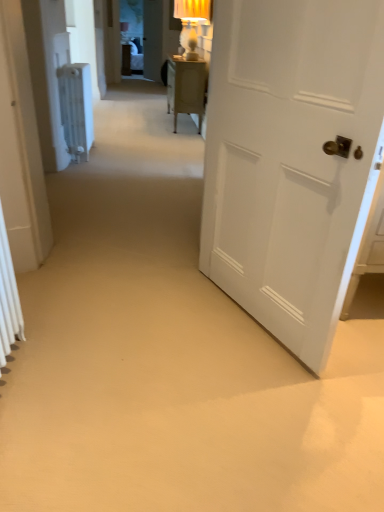
The height and width of the screenshot is (512, 384). I want to click on white matte radiator at left, acting as the first door starting from the left, so click(21, 148).

Locate an element on the screen. This screenshot has width=384, height=512. white plastic radiator at left is located at coordinates (76, 106).

Which object is further away from the camera, white matte door at right, which is counted as the 2th door, starting from the back, or white plastic radiator at left?

white plastic radiator at left is further from the camera.

Between white matte door at right, which is the 1th door in front-to-back order, and white plastic radiator at left, which one appears on the left side from the viewer's perspective?

Positioned to the left is white plastic radiator at left.

Can you confirm if white plastic radiator at left is positioned to the right of white matte door at right, the 1th door viewed from the right?

Incorrect, white plastic radiator at left is not on the right side of white matte door at right, the 1th door viewed from the right.

From a real-world perspective, does white plastic radiator at left stand above white matte door at right, acting as the second door starting from the left?

Incorrect, from a real-world perspective, white plastic radiator at left is lower than white matte door at right, acting as the second door starting from the left.

Could you measure the distance between white plastic radiator at left and white matte door at right, acting as the second door starting from the left?

8.33 feet.

Based on the photo, which is nearer, (88, 119) or (238, 281)?

Point (88, 119) is farther from the camera than point (238, 281).

Which object is further away from the camera taking this photo, white matte radiator at left, which is the second door in front-to-back order, or white matte door at right, acting as the second door starting from the left?

white matte radiator at left, which is the second door in front-to-back order, is behind.

From a real-world perspective, is white matte radiator at left, acting as the first door starting from the left, positioned over white matte door at right, the 1th door viewed from the right, based on gravity?

Yes, from a real-world perspective, white matte radiator at left, acting as the first door starting from the left, is above white matte door at right, the 1th door viewed from the right.

Considering the sizes of white matte radiator at left, which is counted as the first door, starting from the back, and white matte door at right, the 1th door viewed from the right, in the image, is white matte radiator at left, which is counted as the first door, starting from the back, wider or thinner than white matte door at right, the 1th door viewed from the right,?

Considering their sizes, white matte radiator at left, which is counted as the first door, starting from the back, looks slimmer than white matte door at right, the 1th door viewed from the right.

From the image's perspective, between white matte radiator at left, which is the second door from right to left, and white matte door at right, the 1th door viewed from the right, who is located below?

white matte door at right, the 1th door viewed from the right, appears lower in the image.

Can you confirm if white matte door at right, which is counted as the 2th door, starting from the back, is smaller than white matte radiator at left, acting as the first door starting from the left?

Actually, white matte door at right, which is counted as the 2th door, starting from the back, might be larger than white matte radiator at left, acting as the first door starting from the left.

Is white matte door at right, the 1th door viewed from the right, in contact with white matte radiator at left, which is the second door from right to left?

No, white matte door at right, the 1th door viewed from the right, is not next to white matte radiator at left, which is the second door from right to left.

Does point (277, 64) come in front of point (19, 233)?

Yes, point (277, 64) is in front of point (19, 233).

Is white matte door at right, acting as the second door starting from the left, oriented away from white matte radiator at left, which is the second door from right to left?

No.

This screenshot has height=512, width=384. What are the coordinates of `door that is on the left side of white plastic radiator at left` in the screenshot? It's located at (21, 148).

Is point (60, 71) positioned before point (16, 17)?

No, (60, 71) is behind (16, 17).

Is white plastic radiator at left not close to white matte radiator at left, which is counted as the first door, starting from the back?

white plastic radiator at left is far away from white matte radiator at left, which is counted as the first door, starting from the back.

Which of these two, white matte radiator at left, which is the second door in front-to-back order, or white plastic radiator at left, stands shorter?

white plastic radiator at left.

From the picture: Is white matte radiator at left, which is the second door in front-to-back order, touching white plastic radiator at left?

They are not placed beside each other.

Is white plastic radiator at left at the back of white matte radiator at left, which is counted as the first door, starting from the back?

white matte radiator at left, which is counted as the first door, starting from the back, does not have its back to white plastic radiator at left.

You are a GUI agent. You are given a task and a screenshot of the screen. Output one action in this format:
    pyautogui.click(x=<x>, y=<y>)
    Task: Click on the door that appears on the right of white plastic radiator at left
    The width and height of the screenshot is (384, 512).
    Given the screenshot: What is the action you would take?
    pyautogui.click(x=291, y=159)

Where is `radiator above the white matte door at right, which is the 1th door in front-to-back order (from the image's perspective)`? radiator above the white matte door at right, which is the 1th door in front-to-back order (from the image's perspective) is located at coordinates (76, 106).

Looking at the image, which one is located further to white matte radiator at left, which is the second door in front-to-back order, white plastic radiator at left or white matte door at right, which is counted as the 2th door, starting from the back?

The object further to white matte radiator at left, which is the second door in front-to-back order, is white plastic radiator at left.

From the picture: From the image, which object appears to be farther from white matte door at right, which is the 1th door in front-to-back order, white plastic radiator at left or white matte radiator at left, which is counted as the first door, starting from the back?

white plastic radiator at left is positioned further to the anchor white matte door at right, which is the 1th door in front-to-back order.

Considering their positions, is white matte radiator at left, which is counted as the first door, starting from the back, positioned closer to white matte door at right, which is the 1th door in front-to-back order, than white plastic radiator at left?

white matte radiator at left, which is counted as the first door, starting from the back.

When comparing their distances from white matte radiator at left, which is the second door from right to left, does white matte door at right, which is the 1th door in front-to-back order, or white plastic radiator at left seem closer?

Among the two, white matte door at right, which is the 1th door in front-to-back order, is located nearer to white matte radiator at left, which is the second door from right to left.

Considering their positions, is white matte door at right, the 1th door viewed from the right, positioned further to white plastic radiator at left than white matte radiator at left, which is the second door from right to left?

white matte door at right, the 1th door viewed from the right, is further to white plastic radiator at left.

Which object lies further to the anchor point white plastic radiator at left, white matte radiator at left, acting as the first door starting from the left, or white matte door at right, acting as the second door starting from the left?

white matte door at right, acting as the second door starting from the left, lies further to white plastic radiator at left than the other object.

Identify the location of door between white matte door at right, the 1th door viewed from the right, and white plastic radiator at left in the front-back direction. This screenshot has width=384, height=512. (21, 148).